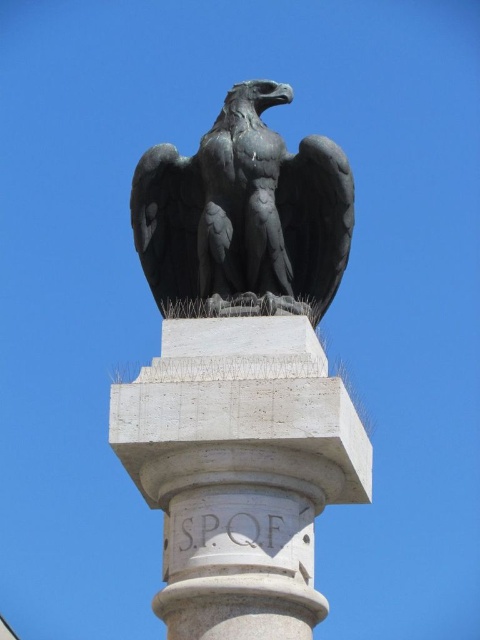
Does white stone pillar at center appear on the right side of polished bronze eagle at top center?

Yes, white stone pillar at center is to the right of polished bronze eagle at top center.

This screenshot has width=480, height=640. Identify the location of white stone pillar at center. (240, 470).